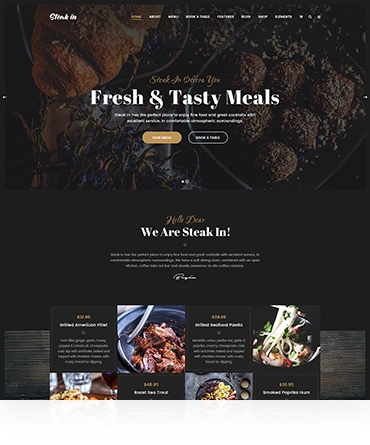
Locate an element on the screen. This screenshot has height=445, width=370. metal ladle is located at coordinates (124, 346).